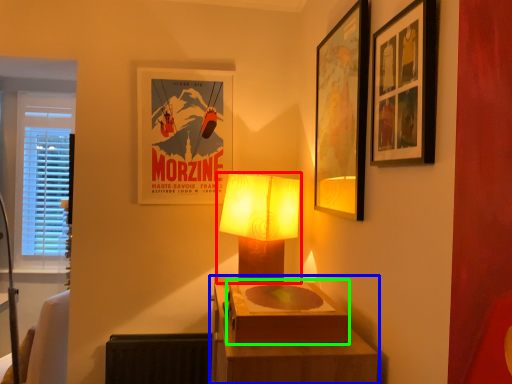
Question: Which is farther away from lamp (highlighted by a red box)? table (highlighted by a blue box) or box (highlighted by a green box)?

Choices:
 (A) table
 (B) box

Answer: (B)